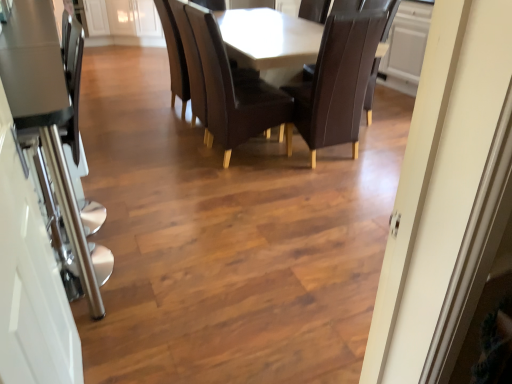
Identify the location of vacant space to the right of dark brown leather chair at center, which appears as the first chair when viewed from the right. (379, 152).